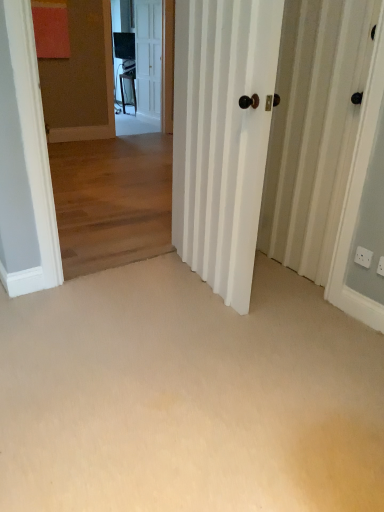
Where is `vacant space situated above beige carpet at center, which is counted as the second corridor, starting from the top (from a real-world perspective)`? The image size is (384, 512). vacant space situated above beige carpet at center, which is counted as the second corridor, starting from the top (from a real-world perspective) is located at coordinates [x=203, y=341].